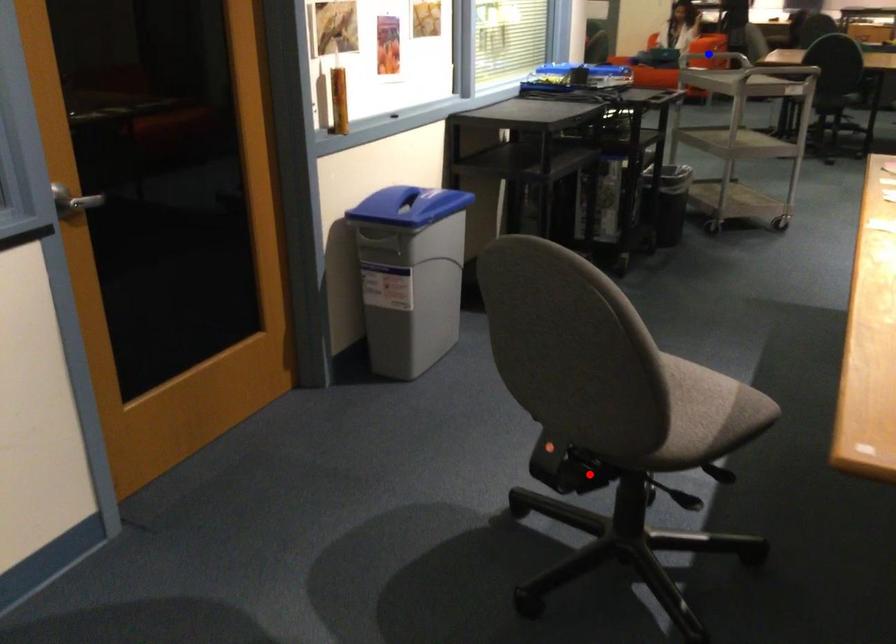
Question: In the image, two points are highlighted. Which point is nearer to the camera? Reply with the corresponding letter.

Choices:
 (A) blue point
 (B) red point

Answer: (B)